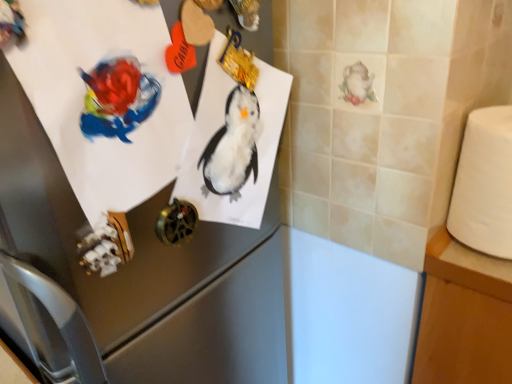
Question: Can you see matte paper penguin at upper left touching satin silver refrigerator at upper left?

Choices:
 (A) yes
 (B) no

Answer: (B)

Question: Can you confirm if matte paper penguin at upper left is positioned to the left of satin silver refrigerator at upper left?

Choices:
 (A) no
 (B) yes

Answer: (B)

Question: Is matte paper penguin at upper left oriented towards satin silver refrigerator at upper left?

Choices:
 (A) no
 (B) yes

Answer: (B)

Question: Is matte paper penguin at upper left closer to camera compared to satin silver refrigerator at upper left?

Choices:
 (A) yes
 (B) no

Answer: (B)

Question: From a real-world perspective, is matte paper penguin at upper left located beneath satin silver refrigerator at upper left?

Choices:
 (A) no
 (B) yes

Answer: (A)

Question: In the image, is white matte toilet paper at right positioned in front of or behind satin silver refrigerator at upper left?

Choices:
 (A) front
 (B) behind

Answer: (B)

Question: Is white matte toilet paper at right inside or outside of satin silver refrigerator at upper left?

Choices:
 (A) inside
 (B) outside

Answer: (B)

Question: Based on their positions, is white matte toilet paper at right located to the left or right of satin silver refrigerator at upper left?

Choices:
 (A) left
 (B) right

Answer: (B)

Question: Considering the positions of white matte toilet paper at right and satin silver refrigerator at upper left in the image, is white matte toilet paper at right wider or thinner than satin silver refrigerator at upper left?

Choices:
 (A) wide
 (B) thin

Answer: (A)

Question: From their relative heights in the image, would you say satin silver refrigerator at upper left is taller or shorter than white wood table at right?

Choices:
 (A) tall
 (B) short

Answer: (B)

Question: From the image's perspective, relative to white wood table at right, is satin silver refrigerator at upper left above or below?

Choices:
 (A) below
 (B) above

Answer: (B)

Question: From a real-world perspective, is satin silver refrigerator at upper left above or below white wood table at right?

Choices:
 (A) below
 (B) above

Answer: (B)

Question: Is satin silver refrigerator at upper left wider or thinner than white wood table at right?

Choices:
 (A) thin
 (B) wide

Answer: (A)

Question: Relative to matte paper penguin at upper left, is white wood table at right in front or behind?

Choices:
 (A) behind
 (B) front

Answer: (A)

Question: In terms of height, does white wood table at right look taller or shorter compared to matte paper penguin at upper left?

Choices:
 (A) short
 (B) tall

Answer: (B)